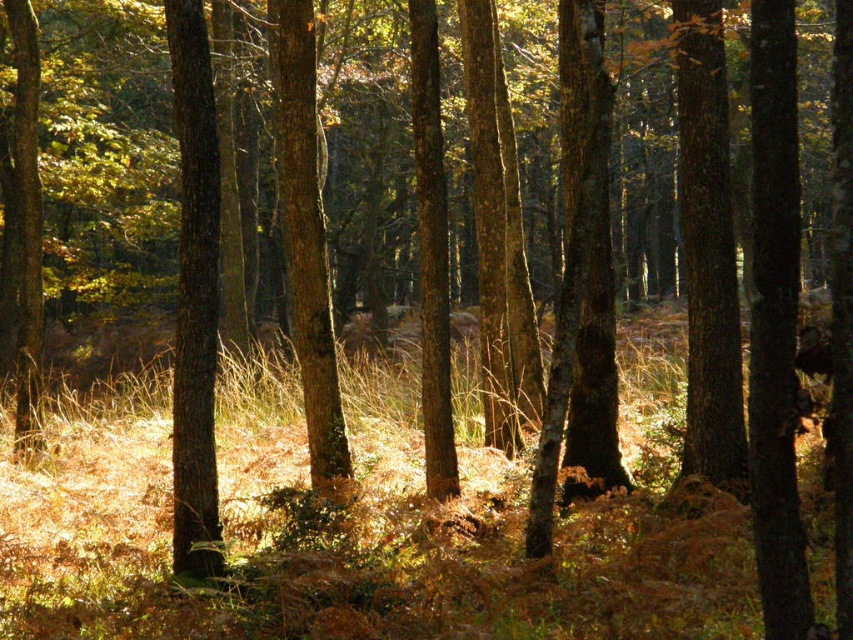
Question: Is brown dry grass at center above smooth bark tree at center?

Choices:
 (A) no
 (B) yes

Answer: (A)

Question: Does smooth bark tree at center have a greater width compared to smooth brown tree trunk at left?

Choices:
 (A) no
 (B) yes

Answer: (A)

Question: Estimate the real-world distances between objects in this image. Which object is closer to the smooth brown tree trunk at left?

Choices:
 (A) brown dry grass at center
 (B) smooth bark tree at center

Answer: (B)

Question: Based on their relative distances, which object is nearer to the smooth bark tree at center?

Choices:
 (A) brown dry grass at center
 (B) smooth brown tree trunk at left
 (C) smooth brown tree trunk at right

Answer: (B)

Question: Which of the following is the farthest from the observer?

Choices:
 (A) brown dry grass at center
 (B) smooth brown tree trunk at left
 (C) smooth brown tree trunk at right
 (D) smooth bark tree at center

Answer: (C)

Question: Does smooth bark tree at center appear on the left side of smooth brown tree trunk at left?

Choices:
 (A) no
 (B) yes

Answer: (A)